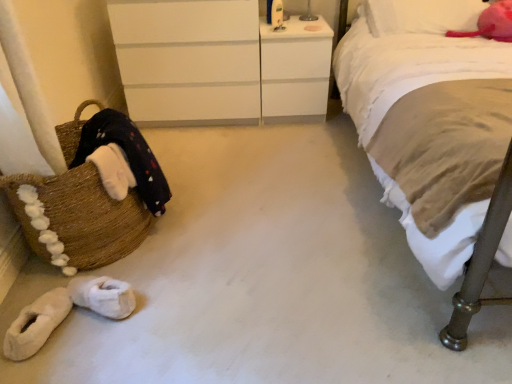
Question: Considering the relative positions of white matte chest of drawers at upper center and brown woven basket at left in the image provided, is white matte chest of drawers at upper center behind brown woven basket at left?

Choices:
 (A) yes
 (B) no

Answer: (A)

Question: From the image's perspective, is white matte chest of drawers at upper center located above brown woven basket at left?

Choices:
 (A) no
 (B) yes

Answer: (B)

Question: Can you confirm if white matte chest of drawers at upper center is wider than brown woven basket at left?

Choices:
 (A) no
 (B) yes

Answer: (B)

Question: Is white matte chest of drawers at upper center closer to camera compared to brown woven basket at left?

Choices:
 (A) no
 (B) yes

Answer: (A)

Question: Is white matte chest of drawers at upper center facing away from brown woven basket at left?

Choices:
 (A) yes
 (B) no

Answer: (B)

Question: Is point (413, 19) closer or farther from the camera than point (128, 294)?

Choices:
 (A) closer
 (B) farther

Answer: (B)

Question: Is velvety pink pillow at upper right to the left or to the right of white fluffy slippers at lower left, the first footwear positioned from the right, in the image?

Choices:
 (A) left
 (B) right

Answer: (B)

Question: Is velvety pink pillow at upper right wider or thinner than white fluffy slippers at lower left, the first footwear positioned from the right?

Choices:
 (A) wide
 (B) thin

Answer: (A)

Question: Do you think velvety pink pillow at upper right is within white fluffy slippers at lower left, the first footwear positioned from the right, or outside of it?

Choices:
 (A) outside
 (B) inside

Answer: (A)

Question: From their relative heights in the image, would you say white fluffy slippers at lower left, the first footwear positioned from the right, is taller or shorter than velvety pink pillow at upper right?

Choices:
 (A) short
 (B) tall

Answer: (A)

Question: Considering the positions of point (130, 286) and point (466, 21), is point (130, 286) closer or farther from the camera than point (466, 21)?

Choices:
 (A) closer
 (B) farther

Answer: (A)

Question: In terms of width, does white fluffy slippers at lower left, the first footwear positioned from the right, look wider or thinner when compared to velvety pink pillow at upper right?

Choices:
 (A) thin
 (B) wide

Answer: (A)

Question: Considering the positions of white fluffy slippers at lower left, placed as the 2th footwear when sorted from left to right, and velvety pink pillow at upper right in the image, is white fluffy slippers at lower left, placed as the 2th footwear when sorted from left to right, bigger or smaller than velvety pink pillow at upper right?

Choices:
 (A) small
 (B) big

Answer: (A)

Question: Is white glossy vanity at upper center spatially inside velvety pink pillow at upper right, or outside of it?

Choices:
 (A) outside
 (B) inside

Answer: (A)

Question: In terms of size, does white glossy vanity at upper center appear bigger or smaller than velvety pink pillow at upper right?

Choices:
 (A) big
 (B) small

Answer: (A)